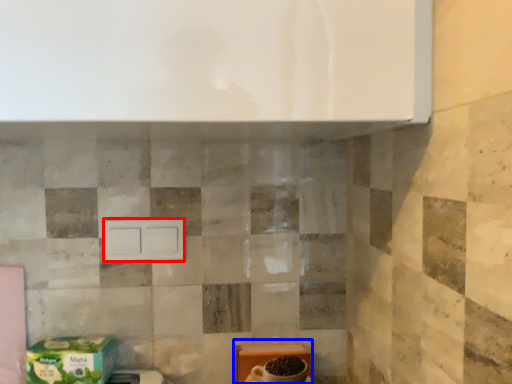
Question: Which object appears closest to the camera in this image, drawer (highlighted by a red box) or cardboard box (highlighted by a blue box)?

Choices:
 (A) drawer
 (B) cardboard box

Answer: (B)